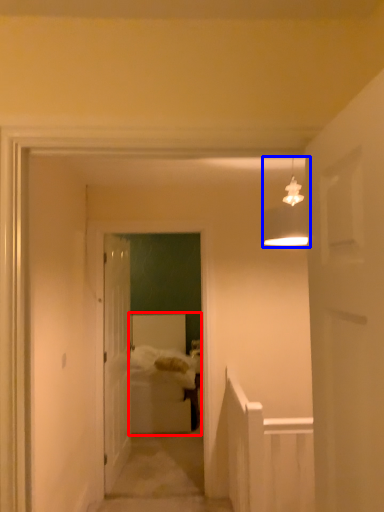
Question: Which point is closer to the camera, bed (highlighted by a red box) or light fixture (highlighted by a blue box)?

Choices:
 (A) bed
 (B) light fixture

Answer: (B)